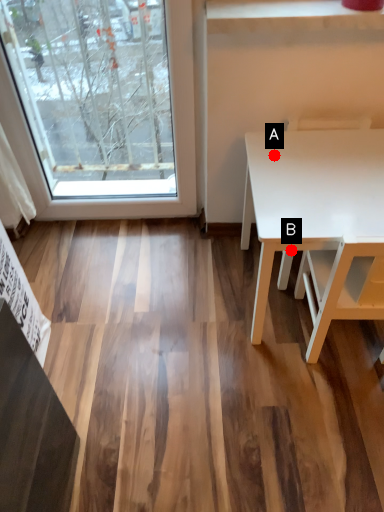
Question: Two points are circled on the image, labeled by A and B beside each circle. Among these points, which one is nearest to the camera?

Choices:
 (A) A is closer
 (B) B is closer

Answer: (B)